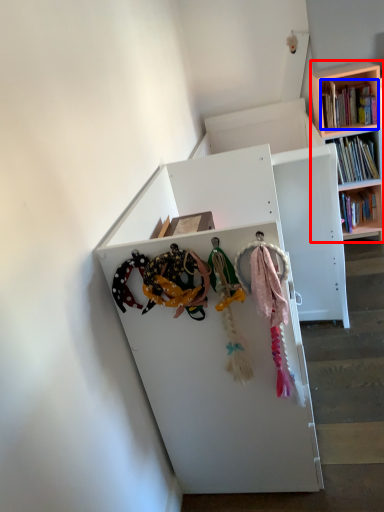
Question: Which object is closer to the camera taking this photo, bookcase (highlighted by a red box) or book (highlighted by a blue box)?

Choices:
 (A) bookcase
 (B) book

Answer: (A)